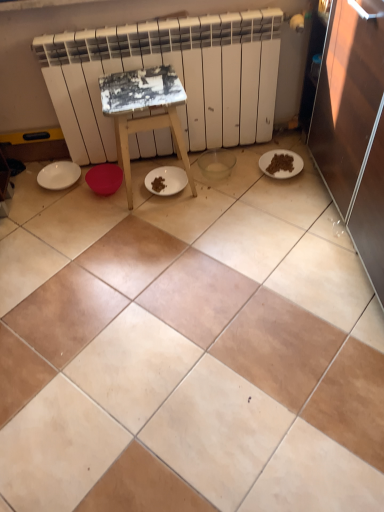
Question: Considering the positions of white matte radiator at upper center and beige ceramic tile at center in the image, is white matte radiator at upper center wider or thinner than beige ceramic tile at center?

Choices:
 (A) wide
 (B) thin

Answer: (B)

Question: Does point (185, 112) appear closer or farther from the camera than point (185, 503)?

Choices:
 (A) closer
 (B) farther

Answer: (B)

Question: Considering the real-world distances, which object is farthest from the white matte plate at lower right, which is the 2th paper plate from left to right?

Choices:
 (A) beige ceramic tile at center
 (B) white matte plate at left, which is counted as the 1th paper plate, starting from the left
 (C) white matte radiator at upper center
 (D) white painted wood stool at center

Answer: (B)

Question: Based on their relative distances, which object is farther from the white painted wood stool at center?

Choices:
 (A) white matte plate at left, which is counted as the 1th paper plate, starting from the left
 (B) white matte radiator at upper center
 (C) white matte plate at lower right, which is the 2th paper plate from left to right
 (D) beige ceramic tile at center

Answer: (D)